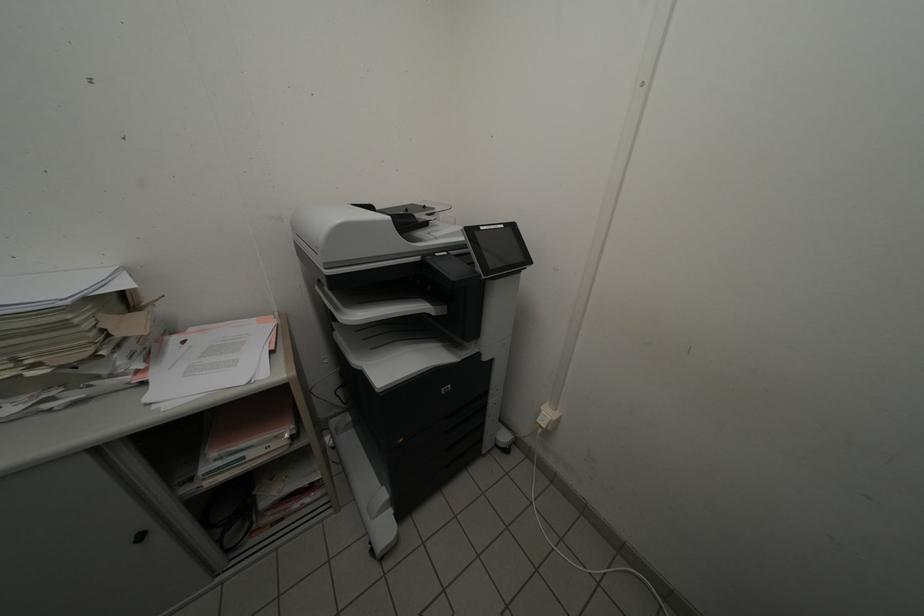
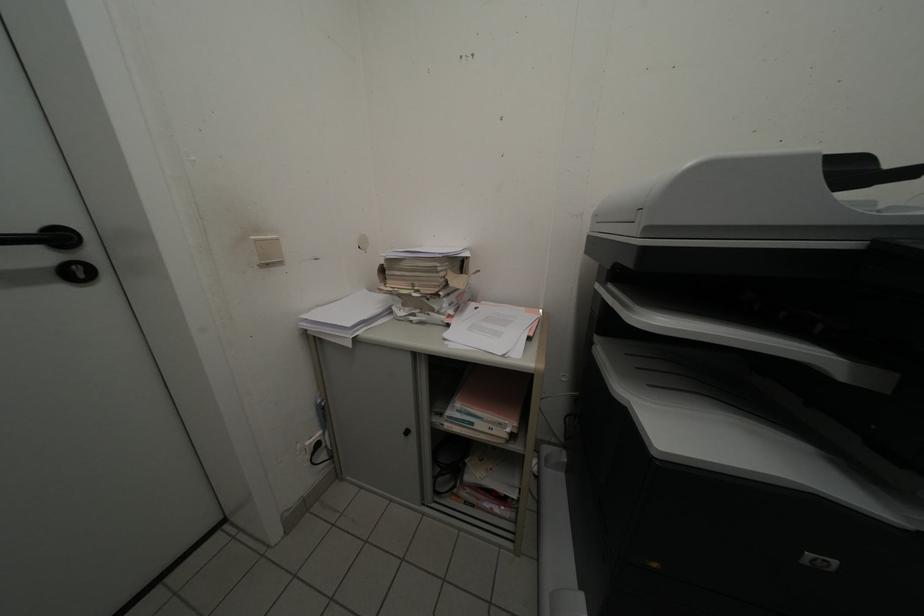
Question: The images are taken continuously from a first-person perspective. In which direction is your viewpoint rotating?

Choices:
 (A) Left
 (B) Right
 (C) Up
 (D) Down

Answer: (A)